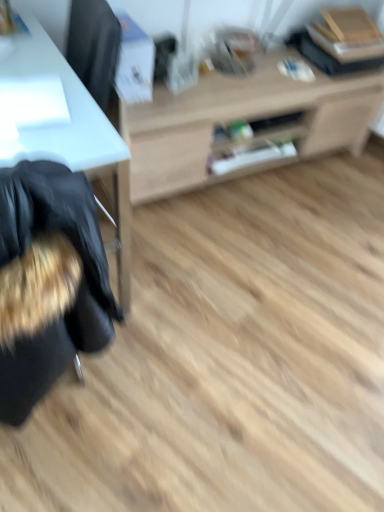
Measure the distance between fuzzy black bean bag chair at left and camera.

fuzzy black bean bag chair at left is 28.44 inches from camera.

Identify the location of fuzzy black bean bag chair at left. (79, 288).

What do you see at coordinates (242, 119) in the screenshot? This screenshot has height=512, width=384. I see `light wood cabinet at center` at bounding box center [242, 119].

Measure the distance between point (194, 185) and camera.

The distance of point (194, 185) from camera is 1.96 meters.

Image resolution: width=384 pixels, height=512 pixels. I want to click on fuzzy black bean bag chair at left, so click(x=79, y=288).

Identify the location of bean bag chair that appears in front of the light wood cabinet at center. The height and width of the screenshot is (512, 384). (79, 288).

Would you say fuzzy black bean bag chair at left contains light wood cabinet at center?

No, light wood cabinet at center is not inside fuzzy black bean bag chair at left.

Consider the image. Can you confirm if fuzzy black bean bag chair at left is shorter than light wood cabinet at center?

In fact, fuzzy black bean bag chair at left may be taller than light wood cabinet at center.

Considering the relative sizes of light wood cabinet at center and white glossy desk at left in the image provided, is light wood cabinet at center taller than white glossy desk at left?

No, light wood cabinet at center is not taller than white glossy desk at left.

Does light wood cabinet at center appear on the right side of white glossy desk at left?

Yes, light wood cabinet at center is to the right of white glossy desk at left.

From a real-world perspective, relative to white glossy desk at left, is light wood cabinet at center vertically above or below?

Clearly, from a real-world perspective, light wood cabinet at center is below white glossy desk at left.

What's the angular difference between light wood cabinet at center and white glossy desk at left's facing directions?

They differ by 2.57 degrees in their facing directions.

Is white glossy desk at left far from light wood cabinet at center?

That's not correct — white glossy desk at left is a little close to light wood cabinet at center.

Relative to light wood cabinet at center, is white glossy desk at left in front or behind?

Clearly, white glossy desk at left is in front of light wood cabinet at center.

Between white glossy desk at left and light wood cabinet at center, which one appears on the right side from the viewer's perspective?

light wood cabinet at center is more to the right.

Considering the points (164, 93) and (117, 310), which point is behind, point (164, 93) or point (117, 310)?

Positioned behind is point (164, 93).

Is light wood cabinet at center bigger than fuzzy black bean bag chair at left?

Yes.

Is light wood cabinet at center located outside fuzzy black bean bag chair at left?

Yes.

Does point (3, 372) come in front of point (70, 99)?

Yes, point (3, 372) is closer to viewer.

Between fuzzy black bean bag chair at left and white glossy desk at left, which one appears on the right side from the viewer's perspective?

fuzzy black bean bag chair at left.

Looking at this image, is fuzzy black bean bag chair at left further to camera compared to white glossy desk at left?

No, the depth of fuzzy black bean bag chair at left is less than that of white glossy desk at left.

Is fuzzy black bean bag chair at left inside white glossy desk at left?

No.

Which object is thinner, white glossy desk at left or fuzzy black bean bag chair at left?

Thinner between the two is fuzzy black bean bag chair at left.

Based on their positions, is white glossy desk at left located to the left or right of fuzzy black bean bag chair at left?

white glossy desk at left is to the left of fuzzy black bean bag chair at left.

Can you tell me how much white glossy desk at left and fuzzy black bean bag chair at left differ in facing direction?

They differ by 176 degrees in their facing directions.

Where is `bean bag chair that is in front of the light wood cabinet at center`? This screenshot has width=384, height=512. bean bag chair that is in front of the light wood cabinet at center is located at coordinates 79,288.

In the image, there is a light wood cabinet at center. Identify the location of desk below it (from the image's perspective). Image resolution: width=384 pixels, height=512 pixels. (77, 136).

From the picture: Which object lies nearer to the anchor point fuzzy black bean bag chair at left, light wood cabinet at center or white glossy desk at left?

Based on the image, white glossy desk at left appears to be nearer to fuzzy black bean bag chair at left.

When comparing their distances from white glossy desk at left, does light wood cabinet at center or fuzzy black bean bag chair at left seem closer?

fuzzy black bean bag chair at left lies closer to white glossy desk at left than the other object.

Consider the image. Based on their spatial positions, is white glossy desk at left or fuzzy black bean bag chair at left closer to light wood cabinet at center?

white glossy desk at left is closer to light wood cabinet at center.

When comparing their distances from white glossy desk at left, does fuzzy black bean bag chair at left or light wood cabinet at center seem closer?

fuzzy black bean bag chair at left is closer to white glossy desk at left.

Considering their positions, is fuzzy black bean bag chair at left positioned closer to light wood cabinet at center than white glossy desk at left?

white glossy desk at left is closer to light wood cabinet at center.

Looking at the image, which one is located further to fuzzy black bean bag chair at left, white glossy desk at left or light wood cabinet at center?

light wood cabinet at center.

Identify the location of desk positioned between fuzzy black bean bag chair at left and light wood cabinet at center from near to far. The height and width of the screenshot is (512, 384). (77, 136).